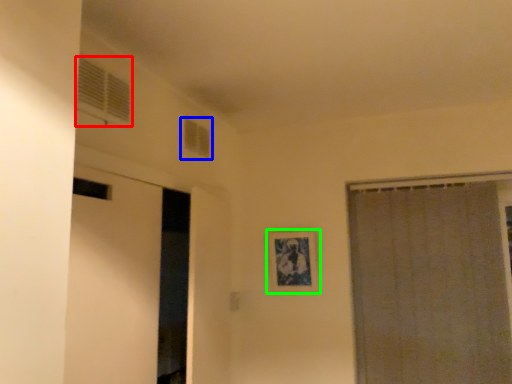
Question: Considering the real-world distances, which object is closest to window (highlighted by a red box)? window (highlighted by a blue box) or picture frame (highlighted by a green box).

Choices:
 (A) window
 (B) picture frame

Answer: (A)